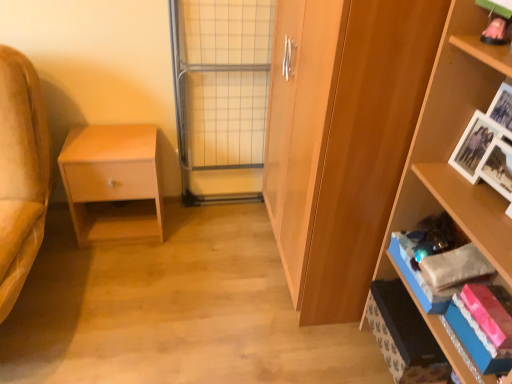
Question: Is wooden cabinet at center oriented away from wooden shelf at right?

Choices:
 (A) yes
 (B) no

Answer: (B)

Question: Considering the relative sizes of wooden cabinet at center and wooden shelf at right in the image provided, is wooden cabinet at center bigger than wooden shelf at right?

Choices:
 (A) no
 (B) yes

Answer: (B)

Question: Is wooden cabinet at center thinner than wooden shelf at right?

Choices:
 (A) no
 (B) yes

Answer: (A)

Question: Considering the relative sizes of wooden cabinet at center and wooden shelf at right in the image provided, is wooden cabinet at center wider than wooden shelf at right?

Choices:
 (A) yes
 (B) no

Answer: (A)

Question: Is wooden cabinet at center behind wooden shelf at right?

Choices:
 (A) yes
 (B) no

Answer: (A)

Question: Is wooden cabinet at center aimed at wooden shelf at right?

Choices:
 (A) yes
 (B) no

Answer: (B)

Question: Can we say wooden shelf at right lies outside matte wood nightstand at left?

Choices:
 (A) yes
 (B) no

Answer: (A)

Question: Considering the relative sizes of wooden shelf at right and matte wood nightstand at left in the image provided, is wooden shelf at right taller than matte wood nightstand at left?

Choices:
 (A) yes
 (B) no

Answer: (A)

Question: Is wooden shelf at right oriented towards matte wood nightstand at left?

Choices:
 (A) yes
 (B) no

Answer: (B)

Question: Considering the relative positions of wooden shelf at right and matte wood nightstand at left in the image provided, is wooden shelf at right in front of matte wood nightstand at left?

Choices:
 (A) yes
 (B) no

Answer: (A)

Question: Considering the relative positions of wooden shelf at right and matte wood nightstand at left in the image provided, is wooden shelf at right to the right of matte wood nightstand at left from the viewer's perspective?

Choices:
 (A) yes
 (B) no

Answer: (A)

Question: From a real-world perspective, is wooden shelf at right physically below matte wood nightstand at left?

Choices:
 (A) no
 (B) yes

Answer: (A)

Question: Is metal grid screen door at center smaller than wooden cabinet at center?

Choices:
 (A) yes
 (B) no

Answer: (A)